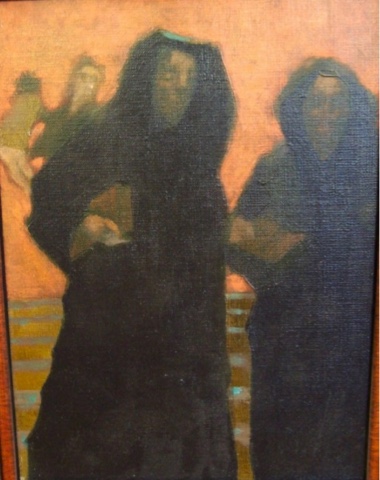
Where is `bottom of robe`? The image size is (380, 480). bottom of robe is located at coordinates (151, 424), (293, 417).